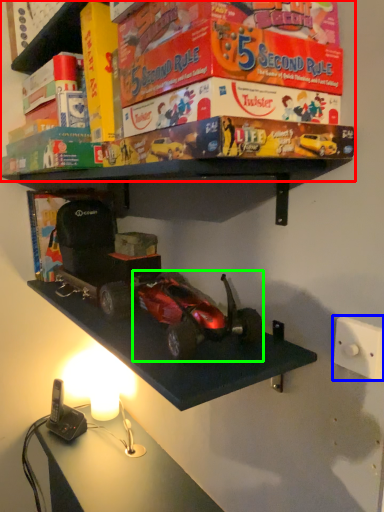
Question: Considering the real-world distances, which object is closest to shelf (highlighted by a red box)? light switch (highlighted by a blue box) or model car (highlighted by a green box).

Choices:
 (A) light switch
 (B) model car

Answer: (B)